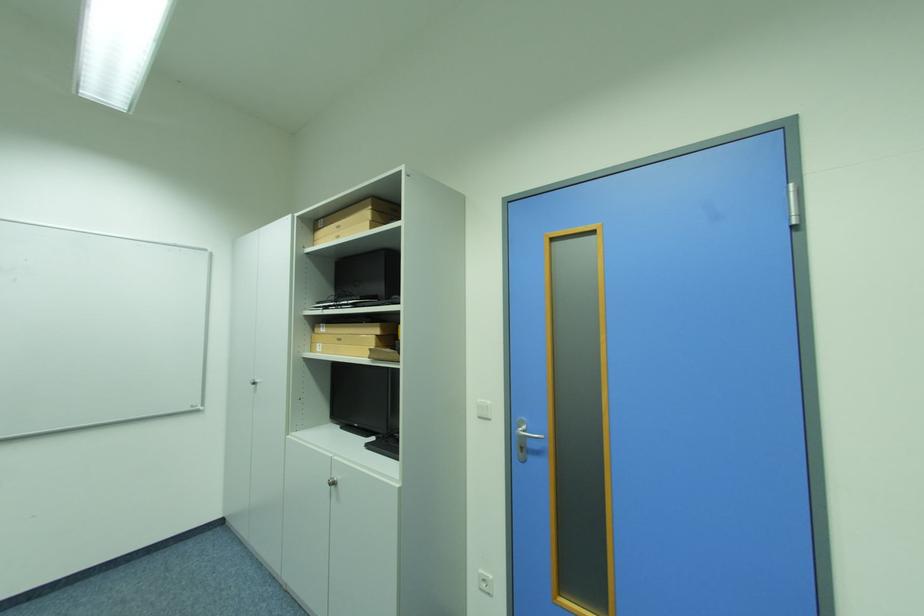
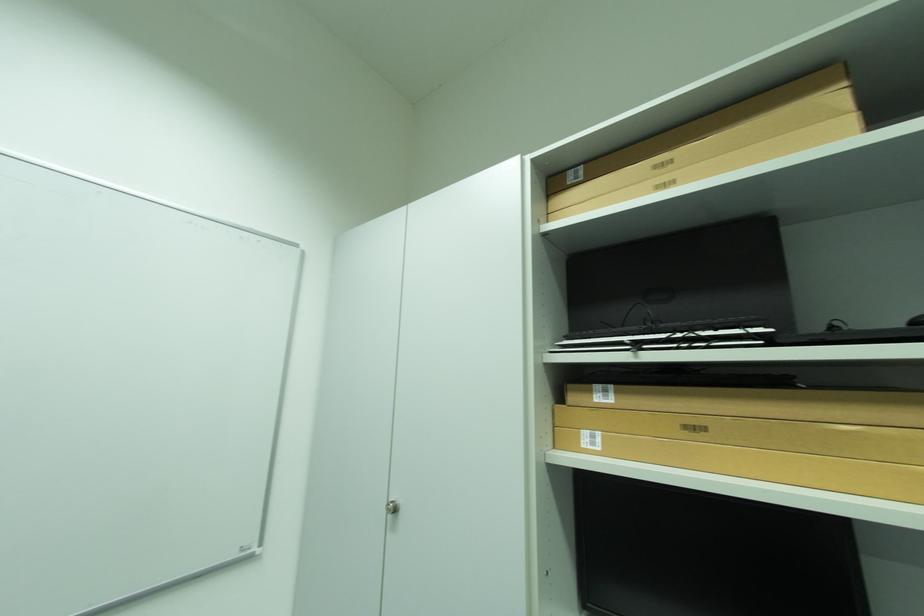
What movement of the cameraman would produce the second image?

The cameraman walked toward left, forward.